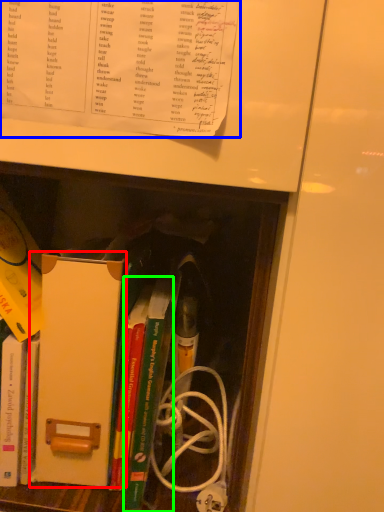
Question: Which object is the closest to the paperback book (highlighted by a red box)? Choose among these: book (highlighted by a blue box) or book (highlighted by a green box).

Choices:
 (A) book
 (B) book

Answer: (B)